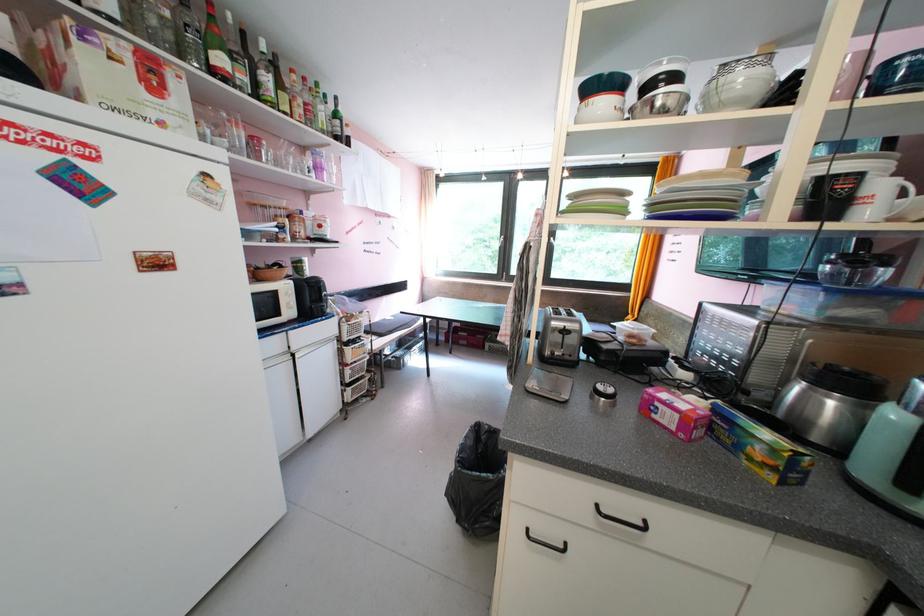
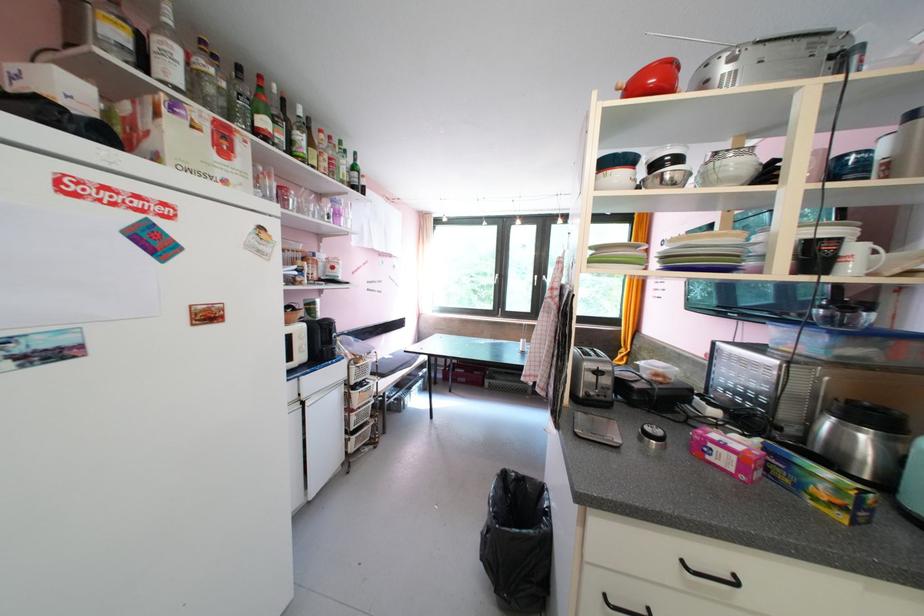
Locate, in the second image, the point that corresponds to [649,524] in the first image.

(736, 578)